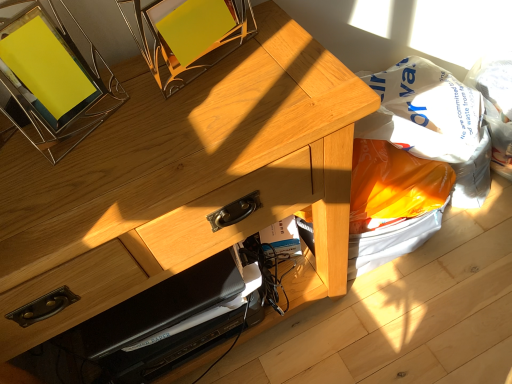
Question: Is natural wood desk at center not near metallic yellow picture frame at upper left?

Choices:
 (A) no
 (B) yes

Answer: (A)

Question: Does natural wood desk at center come behind metallic yellow picture frame at upper left?

Choices:
 (A) yes
 (B) no

Answer: (A)

Question: Is natural wood desk at center shorter than metallic yellow picture frame at upper left?

Choices:
 (A) yes
 (B) no

Answer: (B)

Question: From a real-world perspective, is natural wood desk at center on metallic yellow picture frame at upper left?

Choices:
 (A) no
 (B) yes

Answer: (A)

Question: Does natural wood desk at center have a lesser width compared to metallic yellow picture frame at upper left?

Choices:
 (A) no
 (B) yes

Answer: (A)

Question: Does natural wood desk at center come in front of metallic yellow picture frame at upper left?

Choices:
 (A) no
 (B) yes

Answer: (A)

Question: Are white plastic grocery bag at lower right and metallic yellow picture frame at upper left making contact?

Choices:
 (A) yes
 (B) no

Answer: (B)

Question: From a real-world perspective, is white plastic grocery bag at lower right positioned over metallic yellow picture frame at upper left based on gravity?

Choices:
 (A) yes
 (B) no

Answer: (B)

Question: Is white plastic grocery bag at lower right oriented away from metallic yellow picture frame at upper left?

Choices:
 (A) yes
 (B) no

Answer: (B)

Question: Could you tell me if white plastic grocery bag at lower right is facing metallic yellow picture frame at upper left?

Choices:
 (A) yes
 (B) no

Answer: (B)

Question: Is white plastic grocery bag at lower right bigger than metallic yellow picture frame at upper left?

Choices:
 (A) yes
 (B) no

Answer: (A)

Question: Is white plastic grocery bag at lower right completely or partially outside of metallic yellow picture frame at upper left?

Choices:
 (A) no
 (B) yes

Answer: (B)

Question: From the image's perspective, is white plastic grocery bag at lower right located beneath natural wood desk at center?

Choices:
 (A) no
 (B) yes

Answer: (A)